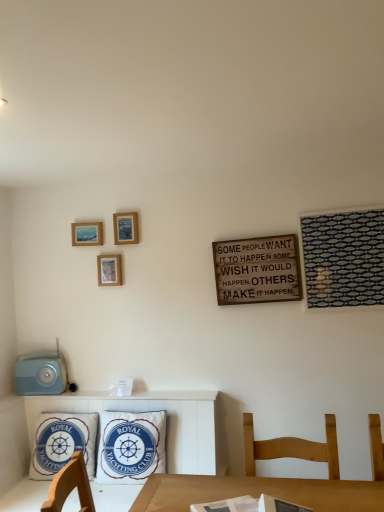
Question: From the image's perspective, is white fabric pillow at center, the 1th pillow in the right-to-left sequence, on top of wooden picture frame at center-left, marked as the 2th picture frame in a right-to-left arrangement?

Choices:
 (A) yes
 (B) no

Answer: (B)

Question: Does white fabric pillow at center, the 1th pillow in the right-to-left sequence, have a greater height compared to wooden picture frame at center-left, acting as the first picture frame starting from the bottom?

Choices:
 (A) no
 (B) yes

Answer: (B)

Question: Is white fabric pillow at center, the 1th pillow in the right-to-left sequence, aimed at wooden picture frame at center-left, acting as the first picture frame starting from the bottom?

Choices:
 (A) yes
 (B) no

Answer: (B)

Question: Is white fabric pillow at center, which ranks as the 2th pillow in left-to-right order, positioned far away from wooden picture frame at center-left, the 3th picture frame when ordered from top to bottom?

Choices:
 (A) no
 (B) yes

Answer: (A)

Question: Considering the relative sizes of white fabric pillow at center, which ranks as the 2th pillow in left-to-right order, and wooden picture frame at center-left, acting as the first picture frame starting from the bottom, in the image provided, is white fabric pillow at center, which ranks as the 2th pillow in left-to-right order, smaller than wooden picture frame at center-left, acting as the first picture frame starting from the bottom,?

Choices:
 (A) no
 (B) yes

Answer: (A)

Question: Considering the relative positions of white fabric pillow at center, the 1th pillow in the right-to-left sequence, and wooden picture frame at center-left, acting as the first picture frame starting from the bottom, in the image provided, is white fabric pillow at center, the 1th pillow in the right-to-left sequence, to the right of wooden picture frame at center-left, acting as the first picture frame starting from the bottom, from the viewer's perspective?

Choices:
 (A) no
 (B) yes

Answer: (B)

Question: Considering the relative positions of wooden signboard at center-right and wooden picture frame at upper left, marked as the 1th picture frame in a left-to-right arrangement, in the image provided, is wooden signboard at center-right in front of wooden picture frame at upper left, marked as the 1th picture frame in a left-to-right arrangement,?

Choices:
 (A) no
 (B) yes

Answer: (B)

Question: Is wooden signboard at center-right far away from wooden picture frame at upper left, arranged as the 2th picture frame when ordered from the bottom?

Choices:
 (A) yes
 (B) no

Answer: (A)

Question: From a real-world perspective, is wooden signboard at center-right on wooden picture frame at upper left, arranged as the 2th picture frame when ordered from the bottom?

Choices:
 (A) yes
 (B) no

Answer: (B)

Question: Would you say wooden signboard at center-right contains wooden picture frame at upper left, marked as the 1th picture frame in a left-to-right arrangement?

Choices:
 (A) no
 (B) yes

Answer: (A)

Question: Does wooden signboard at center-right have a lesser height compared to wooden picture frame at upper left, arranged as the 2th picture frame when ordered from the bottom?

Choices:
 (A) no
 (B) yes

Answer: (A)

Question: Does wooden signboard at center-right turn towards wooden picture frame at upper left, which is the third picture frame in right-to-left order?

Choices:
 (A) yes
 (B) no

Answer: (B)

Question: Does blue cotton pillow at lower left, which is the second pillow from right to left, appear on the right side of wooden picture frame at upper left, which is counted as the second picture frame, starting from the top?

Choices:
 (A) yes
 (B) no

Answer: (B)